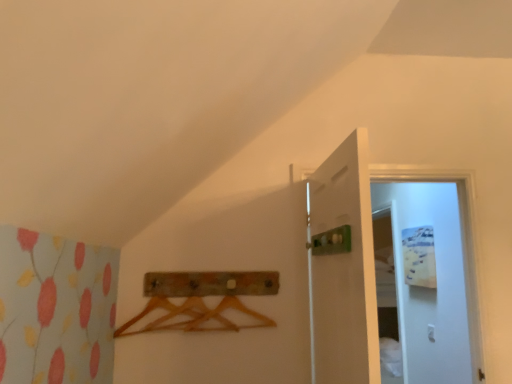
Question: Would you say wooden coat hanger at center is to the left or to the right of white glossy door at upper right, the first door viewed from the right, in the picture?

Choices:
 (A) left
 (B) right

Answer: (A)

Question: Choose the correct answer: Is wooden coat hanger at center inside white glossy door at upper right, the first door viewed from the right, or outside it?

Choices:
 (A) outside
 (B) inside

Answer: (A)

Question: Estimate the real-world distances between objects in this image. Which object is farther from the white matte door at center, the 1th door in the left-to-right sequence?

Choices:
 (A) white glossy door at upper right, the first door viewed from the right
 (B) wooden coat hanger at center

Answer: (A)

Question: Considering the real-world distances, which object is closest to the white glossy door at upper right, the second door viewed from the left?

Choices:
 (A) wooden coat hanger at center
 (B) white matte door at center, placed as the 2th door when sorted from right to left

Answer: (B)